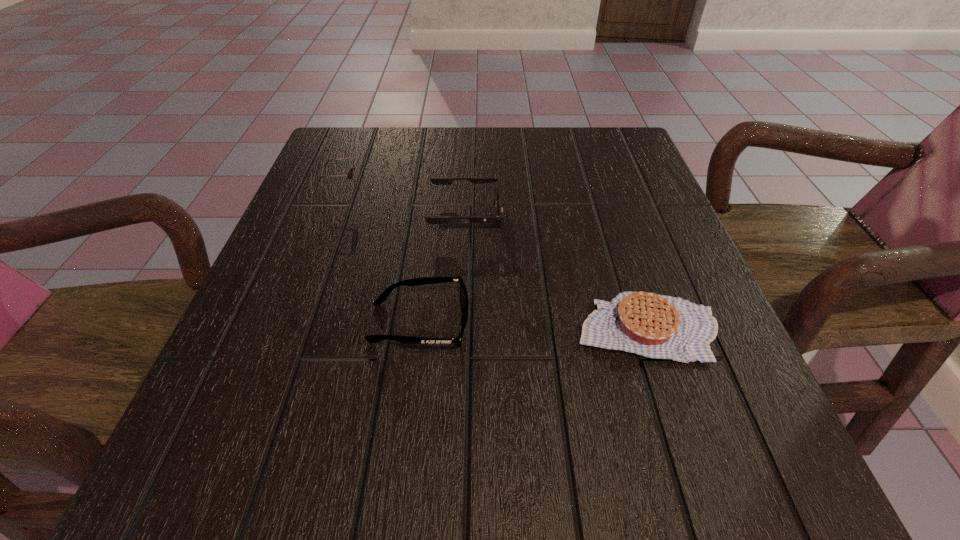
Where is `vacant space that satisfies the following two spatial constraints: 1. on the back side of the shortest object; 2. on the front-facing side of the nearest sunglasses`? vacant space that satisfies the following two spatial constraints: 1. on the back side of the shortest object; 2. on the front-facing side of the nearest sunglasses is located at coordinates (645, 322).